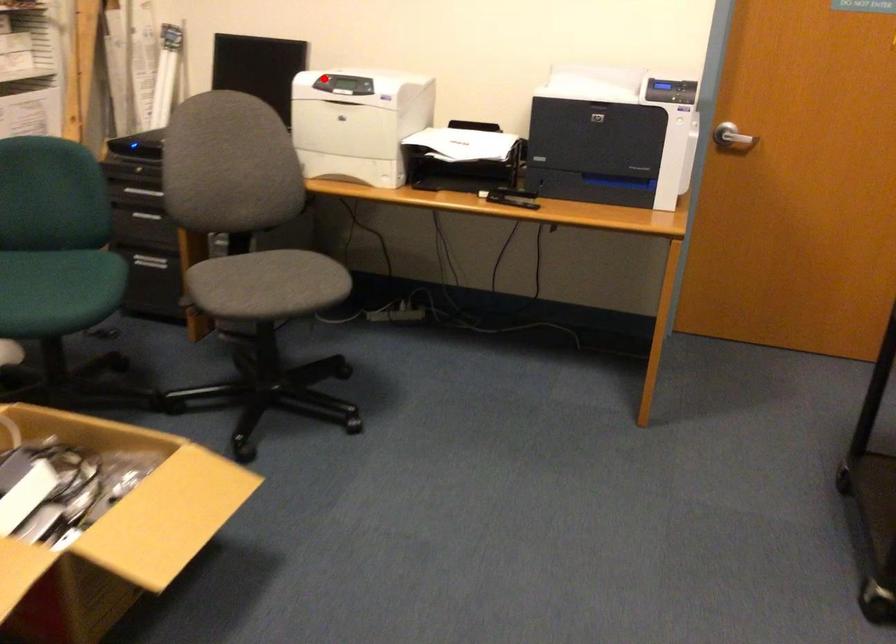
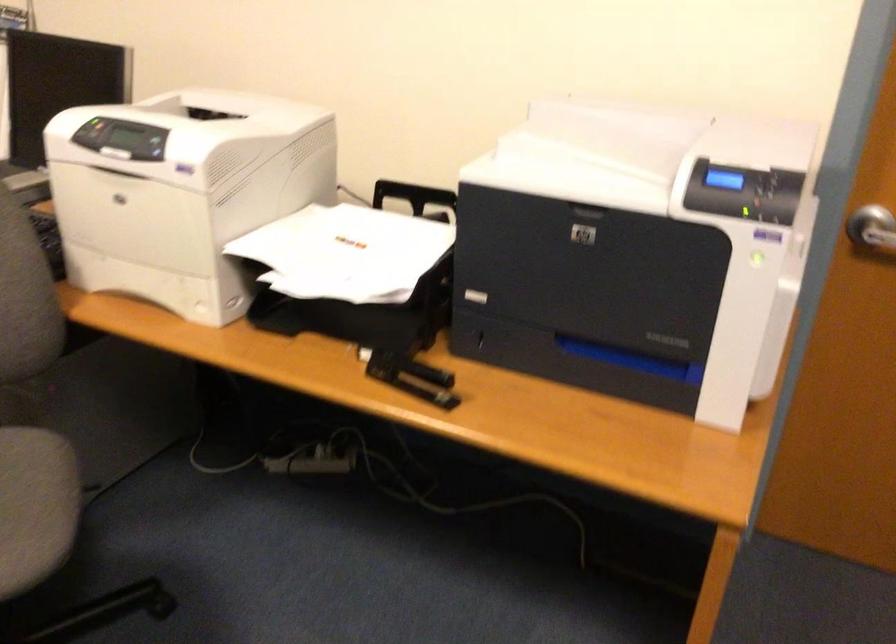
Question: I am providing you with two images of the same scene from different viewpoints. In image1, a red point is highlighted. Considering the same 3D point in image2, which of the following is correct?

Choices:
 (A) It is closer
 (B) It is farther

Answer: (A)